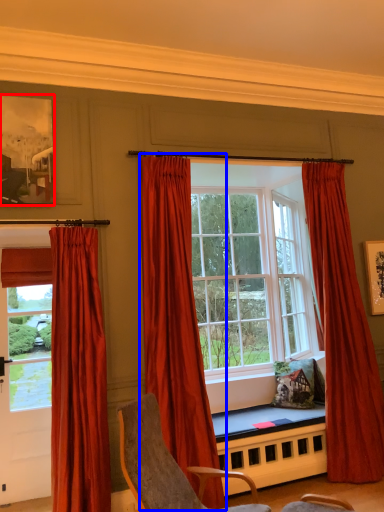
Question: Which point is further to the camera, picture frame (highlighted by a red box) or curtain (highlighted by a blue box)?

Choices:
 (A) picture frame
 (B) curtain

Answer: (A)